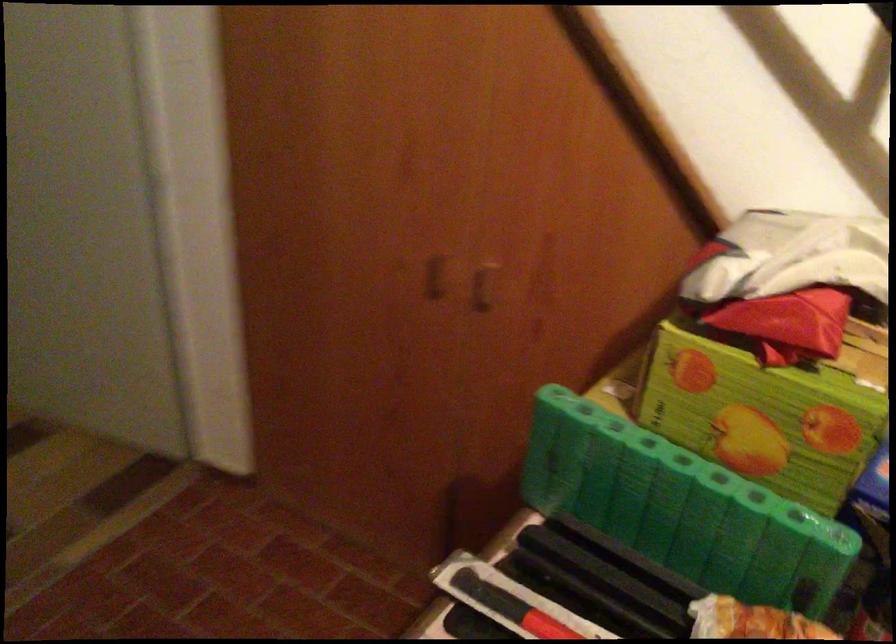
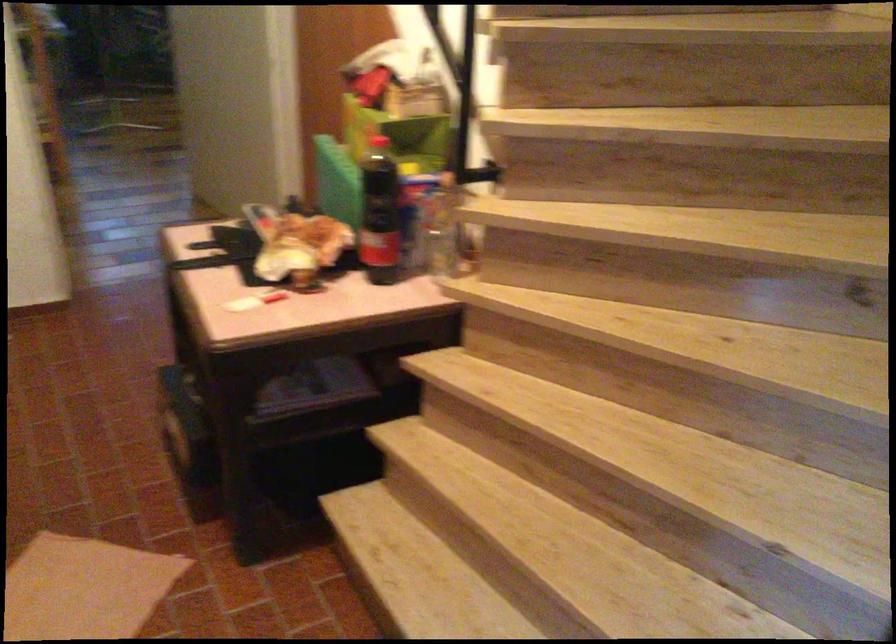
Question: I am providing you with two images of the same scene from different viewpoints. Which of the following objects are not visible in image2?

Choices:
 (A) piece of cardboard
 (B) brown cabinet handle
 (C) red and white lighter
 (D) light blue basket

Answer: (B)